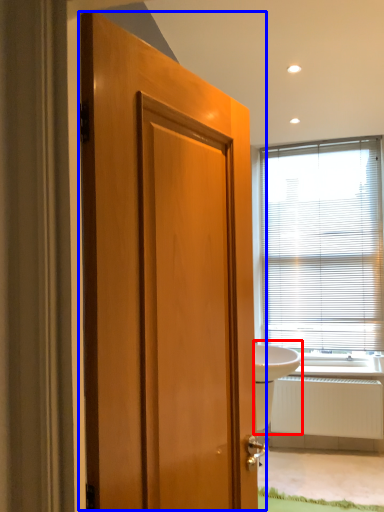
Question: Among these objects, which one is farthest to the camera, sink (highlighted by a red box) or door (highlighted by a blue box)?

Choices:
 (A) sink
 (B) door

Answer: (A)